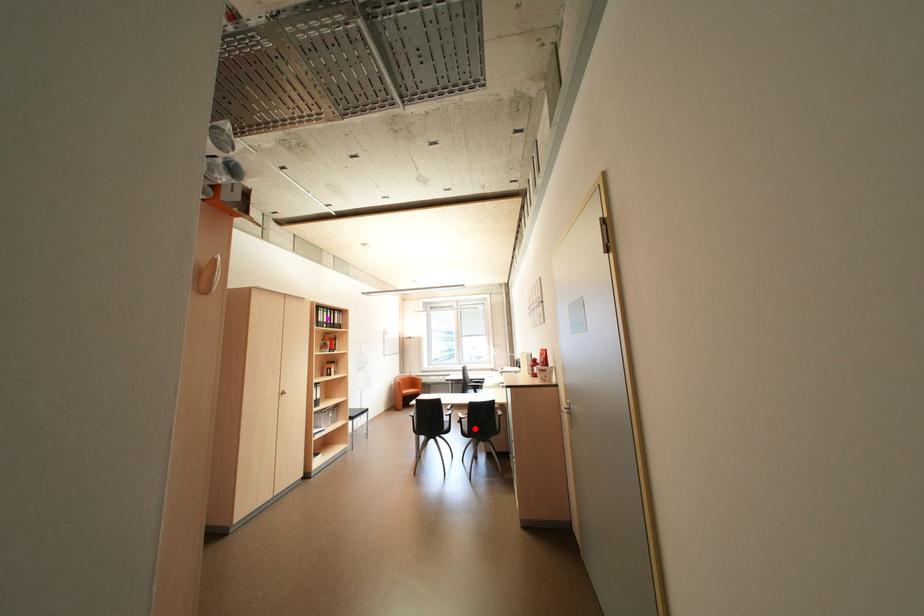
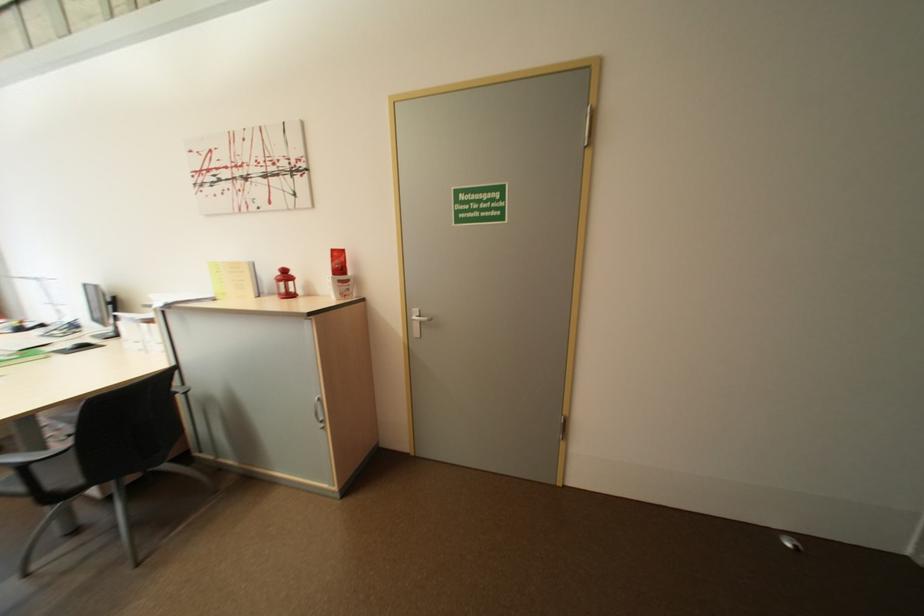
Question: I am providing you with two images of the same scene from different viewpoints. Given a red point in image1, look at the same physical point in image2. Is it:

Choices:
 (A) Closer to the viewpoint
 (B) Farther from the viewpoint

Answer: (A)